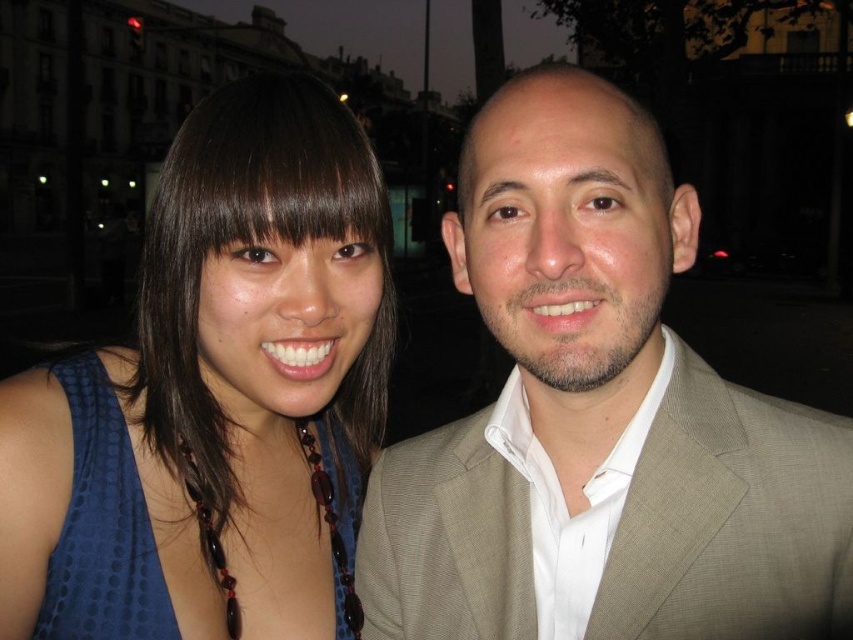
You are trying to identify which object is nearer to you in the image. Based on the scene, can you determine if the tan textured suit at center is closer or farther than the brown hair at upper center?

The tan textured suit at center is closer to the viewer than the brown hair at upper center according to the description.

You are a photographer trying to capture a closeup shot of the tan textured suit at center and the brown hair at upper center. Given that your camera can only focus on objects within 10 inches of each other, will you be able to take the photo without moving the subjects?

The tan textured suit at center is 11.27 inches from the brown hair at upper center. Since the distance exceeds the camera focus range of 10 inches, you won